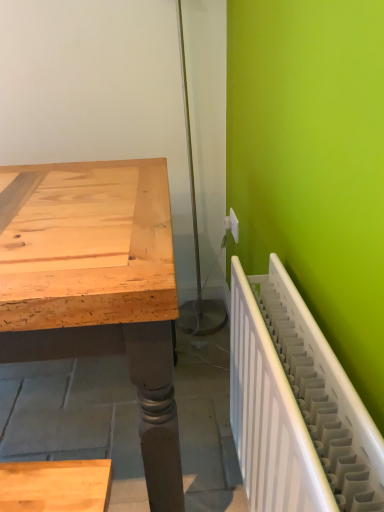
Question: Considering the relative sizes of white plastic electric outlet at upper right and white plastic radiator at lower right in the image provided, is white plastic electric outlet at upper right smaller than white plastic radiator at lower right?

Choices:
 (A) no
 (B) yes

Answer: (B)

Question: Is white plastic electric outlet at upper right looking in the opposite direction of white plastic radiator at lower right?

Choices:
 (A) no
 (B) yes

Answer: (A)

Question: Could you tell me if white plastic electric outlet at upper right is facing white plastic radiator at lower right?

Choices:
 (A) no
 (B) yes

Answer: (A)

Question: Considering the relative sizes of white plastic electric outlet at upper right and white plastic radiator at lower right in the image provided, is white plastic electric outlet at upper right bigger than white plastic radiator at lower right?

Choices:
 (A) yes
 (B) no

Answer: (B)

Question: Is the surface of white plastic electric outlet at upper right in direct contact with white plastic radiator at lower right?

Choices:
 (A) yes
 (B) no

Answer: (B)

Question: Is white plastic electric outlet at upper right to the right of white plastic radiator at lower right from the viewer's perspective?

Choices:
 (A) yes
 (B) no

Answer: (B)

Question: Can you confirm if white plastic radiator at lower right is positioned to the right of white plastic electric outlet at upper right?

Choices:
 (A) no
 (B) yes

Answer: (B)

Question: Is white plastic radiator at lower right not inside white plastic electric outlet at upper right?

Choices:
 (A) yes
 (B) no

Answer: (A)

Question: Is white plastic radiator at lower right to the left of white plastic electric outlet at upper right from the viewer's perspective?

Choices:
 (A) no
 (B) yes

Answer: (A)

Question: Is the position of white plastic radiator at lower right more distant than that of white plastic electric outlet at upper right?

Choices:
 (A) yes
 (B) no

Answer: (B)

Question: From the image's perspective, is white plastic radiator at lower right over white plastic electric outlet at upper right?

Choices:
 (A) no
 (B) yes

Answer: (A)

Question: Can you confirm if white plastic radiator at lower right is wider than white plastic electric outlet at upper right?

Choices:
 (A) yes
 (B) no

Answer: (A)

Question: Is white plastic electric outlet at upper right in front of or behind white plastic radiator at lower right in the image?

Choices:
 (A) front
 (B) behind

Answer: (B)